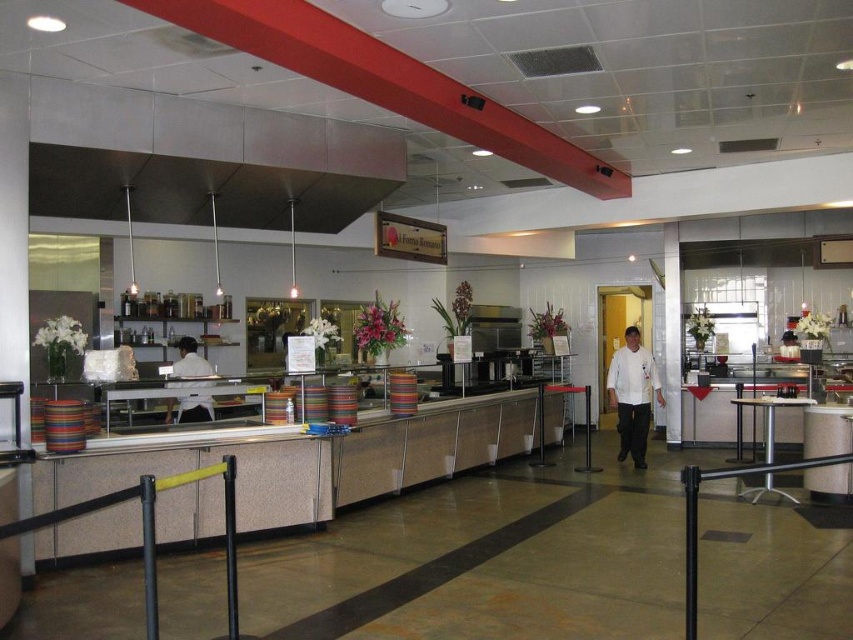
Who is shorter, white chef coat at center or white shirt at center?

white shirt at center is shorter.

Where is `white chef coat at center`? This screenshot has width=853, height=640. white chef coat at center is located at coordinates (633, 396).